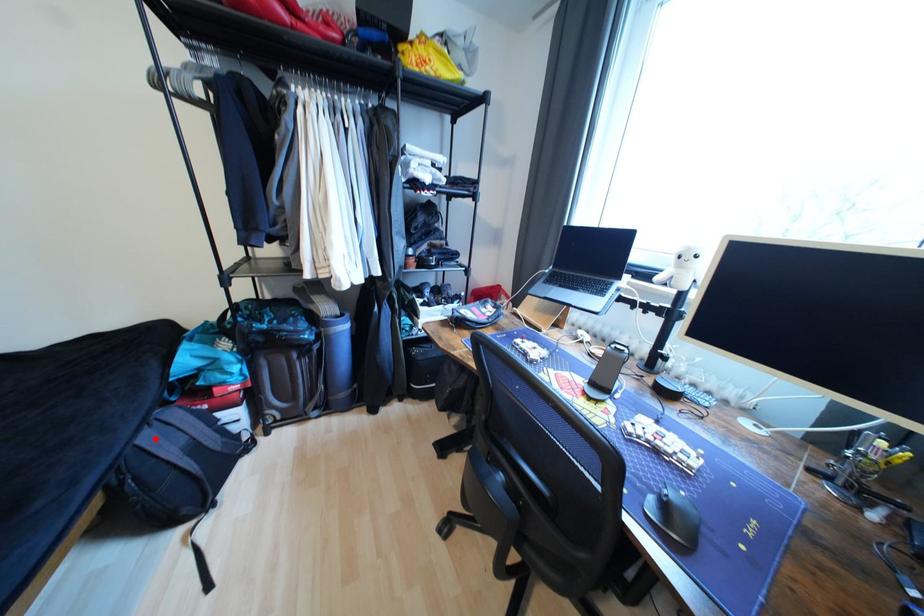
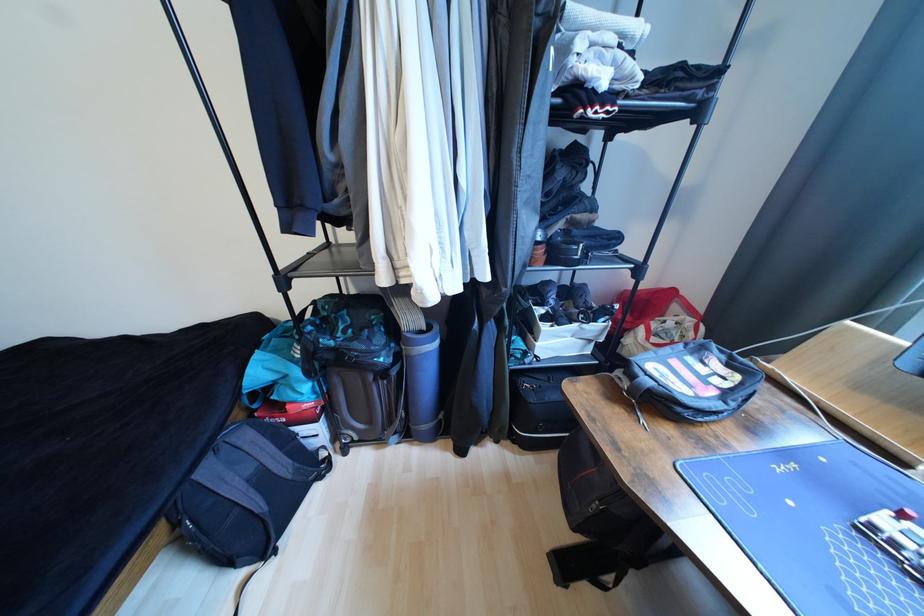
Locate, in the second image, the point that corresponds to the highlighted location in the first image.

(215, 472)